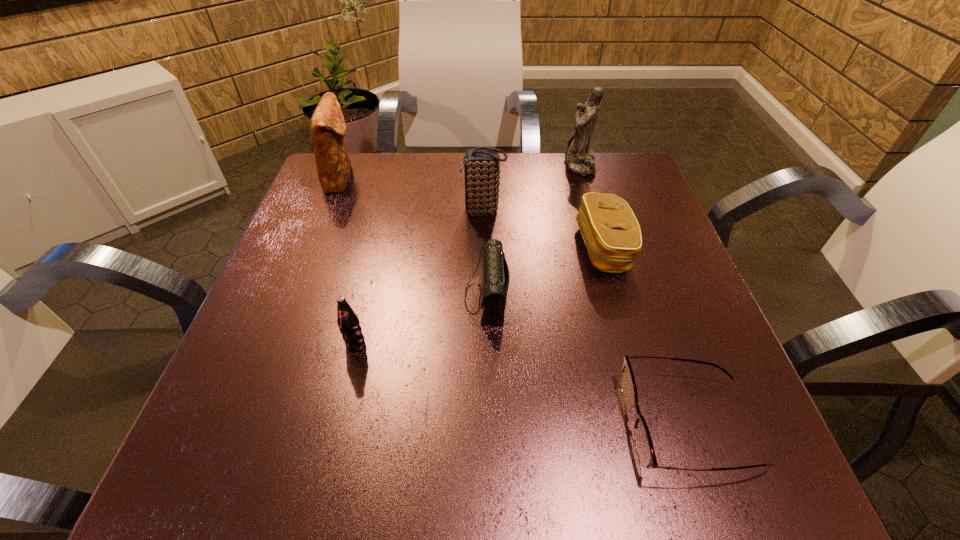
Find the location of a particular element. The width and height of the screenshot is (960, 540). free region located on the zipper side of the rightmost clutch bag is located at coordinates (422, 248).

The width and height of the screenshot is (960, 540). In order to click on free space located 0.220m on the face of the spectacles in this screenshot , I will do `click(482, 424)`.

Where is `vacant space situated 0.300m on the face of the spectacles`? This screenshot has width=960, height=540. vacant space situated 0.300m on the face of the spectacles is located at coordinates (428, 424).

Where is `free spot located 0.300m on the face of the spectacles`? free spot located 0.300m on the face of the spectacles is located at coordinates (428, 424).

Locate an element on the screen. This screenshot has height=540, width=960. figurine located in the far edge section of the desktop is located at coordinates (579, 157).

You are a GUI agent. You are given a task and a screenshot of the screen. Output one action in this format:
    pyautogui.click(x=<x>, y=<y>)
    Task: Click on the object that is at the near edge
    The image size is (960, 540).
    Given the screenshot: What is the action you would take?
    pyautogui.click(x=644, y=446)

Identify the location of object that is positioned at the left edge. (328, 127).

I want to click on figurine that is at the right edge, so click(x=579, y=157).

I want to click on clutch bag present at the right edge, so click(611, 232).

Identify the location of spectacles that is at the right edge. (644, 446).